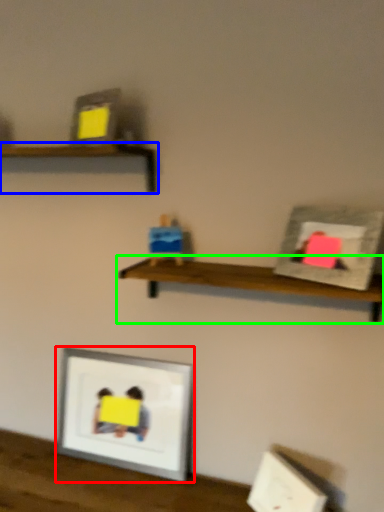
Question: Based on their relative distances, which object is nearer to picture frame (highlighted by a red box)? Choose from shelf (highlighted by a blue box) and shelf (highlighted by a green box).

Choices:
 (A) shelf
 (B) shelf

Answer: (B)